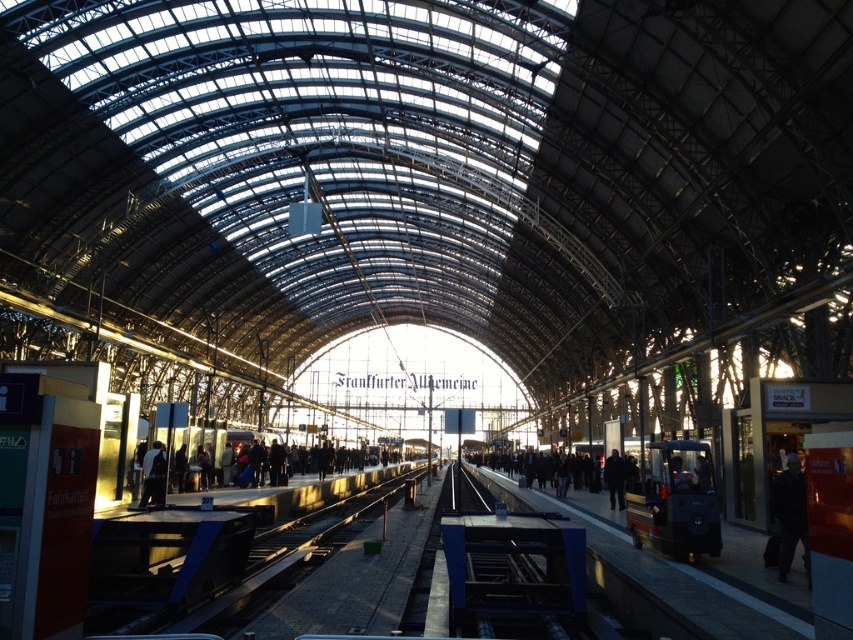
Between dark clothing at platform center and dark blue jacket at right, which one appears on the right side from the viewer's perspective?

Positioned to the right is dark blue jacket at right.

Describe the element at coordinates (299, 490) in the screenshot. I see `dark clothing at platform center` at that location.

Identify the location of dark clothing at platform center. The image size is (853, 640). (299, 490).

Which is more to the left, black fabric person at center or dark blue jacket at center?

black fabric person at center is more to the left.

Is black fabric person at center closer to camera compared to dark blue jacket at center?

Yes, it is.

Does point (518, 492) lie in front of point (612, 458)?

No, it is not.

In order to click on black fabric person at center in this screenshot , I will do `click(563, 499)`.

In the scene shown: Is dark gray jacket at left to the right of dark blue jacket at center from the viewer's perspective?

In fact, dark gray jacket at left is to the left of dark blue jacket at center.

Looking at this image, is dark gray jacket at left further to camera compared to dark blue jacket at center?

That is False.

This screenshot has height=640, width=853. In order to click on dark gray jacket at left in this screenshot , I will do `click(154, 474)`.